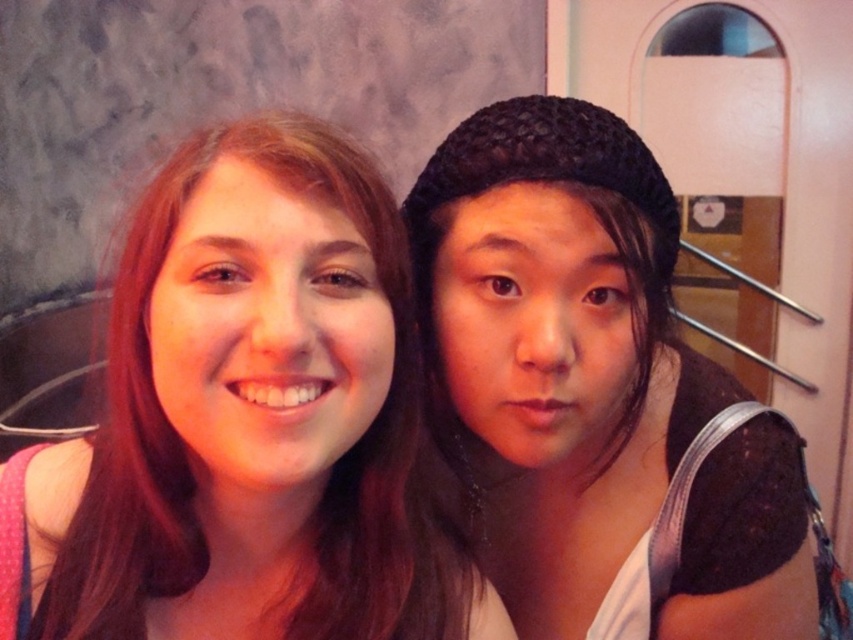
Question: Is matte pink shirt at left positioned in front of black knitted hat at right?

Choices:
 (A) no
 (B) yes

Answer: (B)

Question: Which point appears farthest from the camera in this image?

Choices:
 (A) (308, 276)
 (B) (469, 186)

Answer: (B)

Question: Considering the relative positions of matte pink shirt at left and black knitted hat at right in the image provided, where is matte pink shirt at left located with respect to black knitted hat at right?

Choices:
 (A) right
 (B) left

Answer: (B)

Question: Which point appears closest to the camera in this image?

Choices:
 (A) (575, 604)
 (B) (387, 253)

Answer: (B)

Question: Does matte pink shirt at left appear over black knitted hat at right?

Choices:
 (A) no
 (B) yes

Answer: (B)